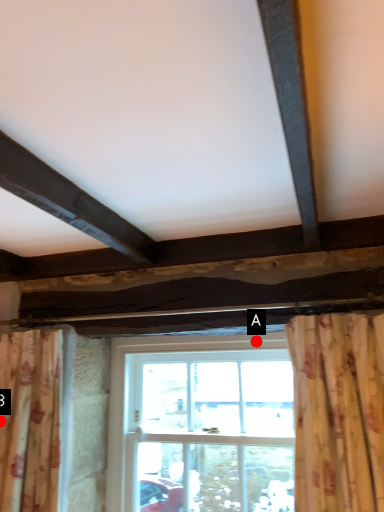
Question: Two points are circled on the image, labeled by A and B beside each circle. Which point is closer to the camera taking this photo?

Choices:
 (A) A is closer
 (B) B is closer

Answer: (B)